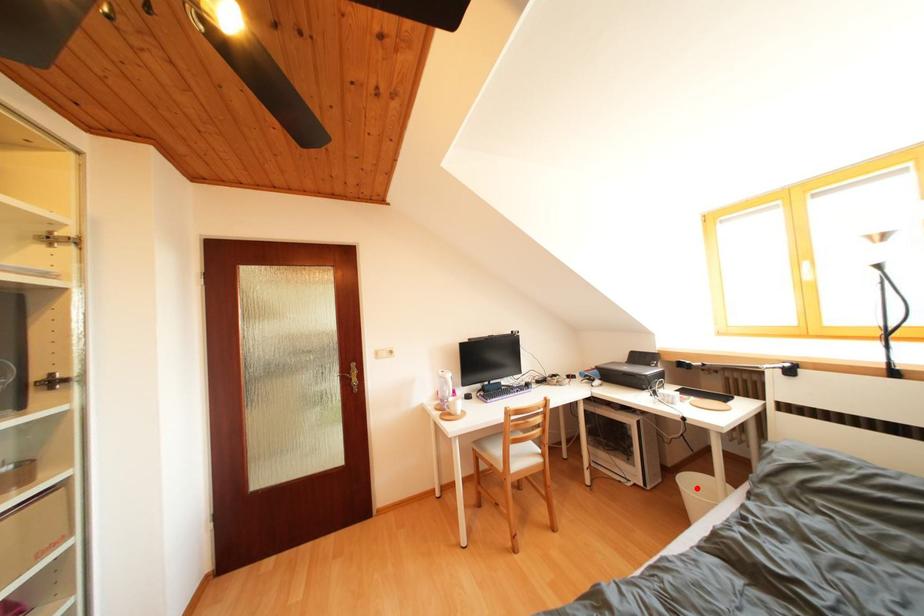
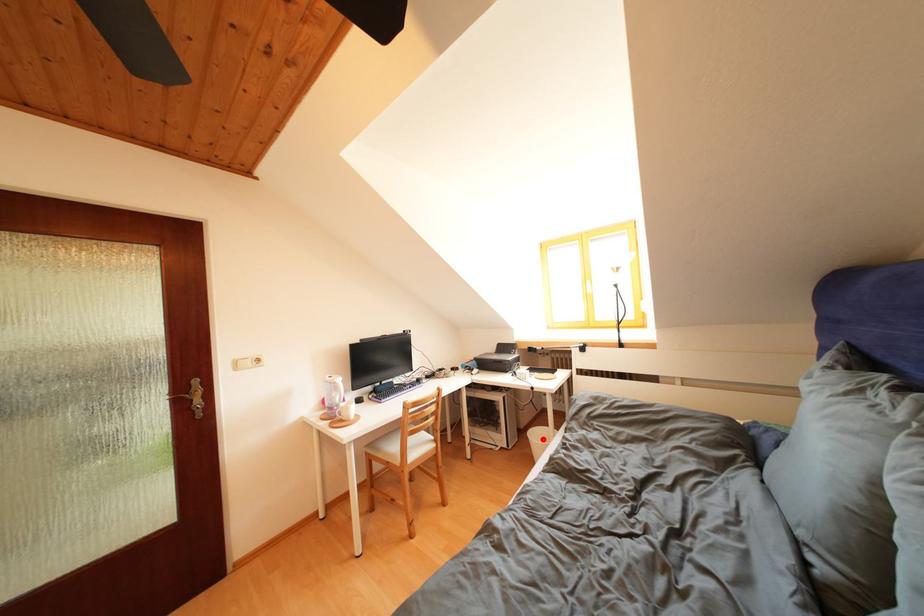
I am providing you with two images of the same scene from different viewpoints. A red point is marked on the first image and another point is marked on the second image. Does the point marked in image1 correspond to the same location as the one in image2?

Yes